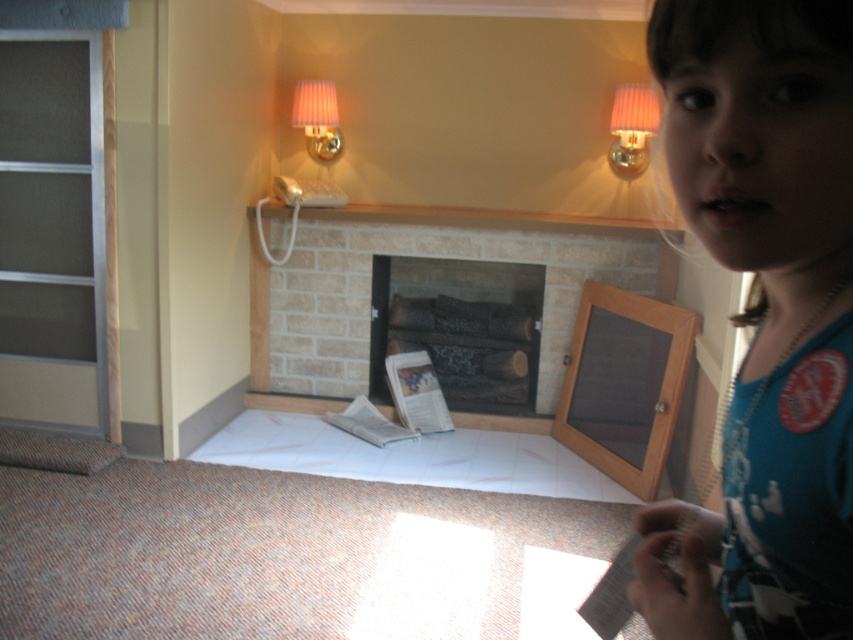
Question: Which point appears closest to the camera in this image?

Choices:
 (A) (828, 461)
 (B) (346, 296)

Answer: (A)

Question: Which of these objects is positioned closest to the blue cotton shirt at upper right?

Choices:
 (A) charcoal wood logs at center
 (B) pink fabric lampshade at upper center

Answer: (A)

Question: Does brick fireplace at center have a greater width compared to charcoal wood logs at center?

Choices:
 (A) yes
 (B) no

Answer: (A)

Question: Which of the following is the farthest from the observer?

Choices:
 (A) charcoal wood logs at center
 (B) blue cotton shirt at upper right
 (C) brick fireplace at center

Answer: (A)

Question: Where is blue cotton shirt at upper right located in relation to pink fabric lampshade at upper right in the image?

Choices:
 (A) right
 (B) left

Answer: (B)

Question: Can you confirm if brick fireplace at center is positioned above charcoal wood logs at center?

Choices:
 (A) yes
 (B) no

Answer: (A)